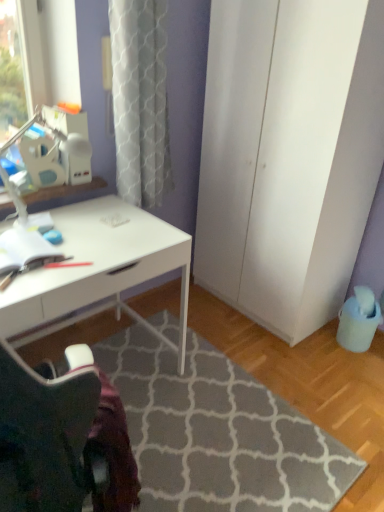
Question: Can you confirm if gray textured rug at lower center is thinner than white glossy desk at center?

Choices:
 (A) yes
 (B) no

Answer: (B)

Question: Does gray textured rug at lower center have a larger size compared to white glossy desk at center?

Choices:
 (A) no
 (B) yes

Answer: (A)

Question: Can you confirm if gray textured rug at lower center is wider than white glossy desk at center?

Choices:
 (A) no
 (B) yes

Answer: (B)

Question: Is gray textured rug at lower center completely or partially outside of white glossy desk at center?

Choices:
 (A) no
 (B) yes

Answer: (B)

Question: Is gray textured rug at lower center at the right side of white glossy desk at center?

Choices:
 (A) yes
 (B) no

Answer: (A)

Question: Considering the relative sizes of gray textured rug at lower center and white glossy desk at center in the image provided, is gray textured rug at lower center taller than white glossy desk at center?

Choices:
 (A) yes
 (B) no

Answer: (B)

Question: Is white matte cabinet at right placed right next to gray textured rug at lower center?

Choices:
 (A) no
 (B) yes

Answer: (A)

Question: From the image's perspective, would you say white matte cabinet at right is positioned over gray textured rug at lower center?

Choices:
 (A) yes
 (B) no

Answer: (A)

Question: Does white matte cabinet at right have a lesser height compared to gray textured rug at lower center?

Choices:
 (A) no
 (B) yes

Answer: (A)

Question: Could you tell me if white matte cabinet at right is facing gray textured rug at lower center?

Choices:
 (A) no
 (B) yes

Answer: (B)

Question: Does white matte cabinet at right have a greater width compared to gray textured rug at lower center?

Choices:
 (A) no
 (B) yes

Answer: (A)

Question: Is white matte cabinet at right outside of gray textured rug at lower center?

Choices:
 (A) yes
 (B) no

Answer: (A)

Question: Considering the relative sizes of white glossy desk at center and gray textured rug at lower center in the image provided, is white glossy desk at center bigger than gray textured rug at lower center?

Choices:
 (A) no
 (B) yes

Answer: (B)